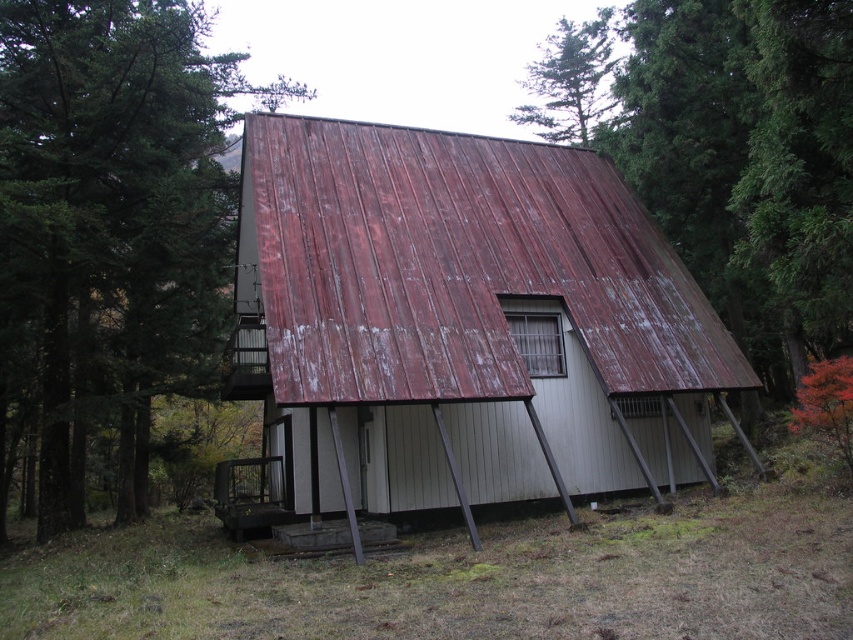
You are standing on the ground in front of the house and want to take a photo of both the green leafy tree at left and the green textured tree at upper center in the same frame. Which direction should you face to include both trees in your photo?

You should face towards the center of the two trees since the green leafy tree at left is to the left of the green textured tree at upper center, so centering between them would capture both in the frame.

You are standing on the porch of the rustic A_frame house and looking towards the forest. You see two trees labeled green textured tree at upper center and green leafy tree at upper center. Which tree is closer to the house?

The green textured tree at upper center is closer to the house because it is positioned under the green leafy tree at upper center, indicating it is in front of the latter.